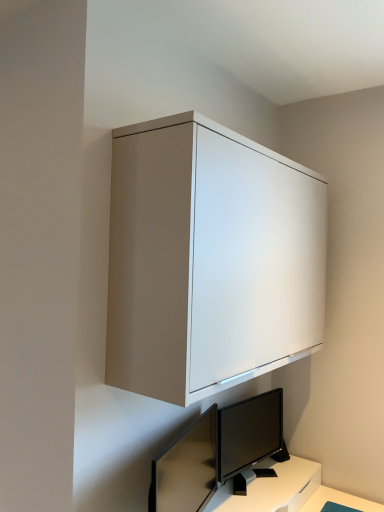
Question: Is matte white cabinet at upper center surrounded by matte black monitor at lower center, which is the first computer monitor in left-to-right order?

Choices:
 (A) yes
 (B) no

Answer: (B)

Question: From the image's perspective, does matte black monitor at lower center, the 1th computer monitor positioned from the front, appear lower than matte white cabinet at upper center?

Choices:
 (A) no
 (B) yes

Answer: (B)

Question: Is matte black monitor at lower center, which is the first computer monitor in left-to-right order, to the right of matte white cabinet at upper center from the viewer's perspective?

Choices:
 (A) yes
 (B) no

Answer: (B)

Question: Is matte black monitor at lower center, the 1th computer monitor positioned from the front, oriented away from matte white cabinet at upper center?

Choices:
 (A) yes
 (B) no

Answer: (B)

Question: Is matte black monitor at lower center, the 1th computer monitor positioned from the front, behind matte white cabinet at upper center?

Choices:
 (A) yes
 (B) no

Answer: (A)

Question: In the image, is matte white cabinet at upper center positioned in front of or behind matte black monitor at lower center, the 1th computer monitor positioned from the front?

Choices:
 (A) behind
 (B) front

Answer: (B)

Question: Is matte white cabinet at upper center spatially inside matte black monitor at lower center, which is the 2th computer monitor from right to left, or outside of it?

Choices:
 (A) inside
 (B) outside

Answer: (B)

Question: Looking at the image, does matte white cabinet at upper center seem bigger or smaller compared to matte black monitor at lower center, which is the second computer monitor in back-to-front order?

Choices:
 (A) small
 (B) big

Answer: (B)

Question: In terms of height, does matte white cabinet at upper center look taller or shorter compared to matte black monitor at lower center, which is the 2th computer monitor from right to left?

Choices:
 (A) short
 (B) tall

Answer: (B)

Question: Is black glossy monitor at lower center, which is the 1th computer monitor from back to front, bigger or smaller than matte black monitor at lower center, which is the 2th computer monitor from right to left?

Choices:
 (A) small
 (B) big

Answer: (A)

Question: From their relative heights in the image, would you say black glossy monitor at lower center, which is the 1th computer monitor from back to front, is taller or shorter than matte black monitor at lower center, which is the second computer monitor in back-to-front order?

Choices:
 (A) short
 (B) tall

Answer: (A)

Question: Is point (233, 444) closer or farther from the camera than point (190, 509)?

Choices:
 (A) farther
 (B) closer

Answer: (A)

Question: In the image, is black glossy monitor at lower center, the first computer monitor from the right, positioned in front of or behind matte black monitor at lower center, which is the 2th computer monitor from right to left?

Choices:
 (A) front
 (B) behind

Answer: (B)

Question: Which is correct: matte black monitor at lower center, the 1th computer monitor positioned from the front, is inside matte white cabinet at upper center, or outside of it?

Choices:
 (A) inside
 (B) outside

Answer: (B)

Question: Visually, is matte black monitor at lower center, the 1th computer monitor positioned from the front, positioned to the left or to the right of matte white cabinet at upper center?

Choices:
 (A) left
 (B) right

Answer: (A)